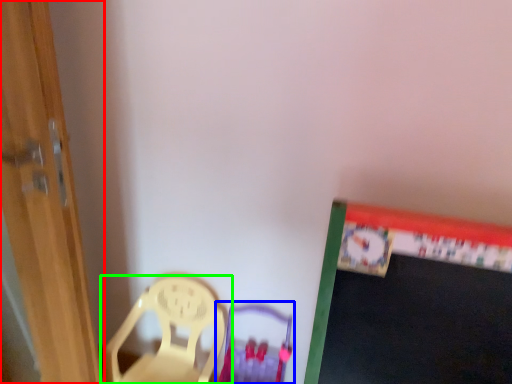
Question: Estimate the real-world distances between objects in this image. Which object is farther from door (highlighted by a red box), armchair (highlighted by a blue box) or chair (highlighted by a green box)?

Choices:
 (A) armchair
 (B) chair

Answer: (A)